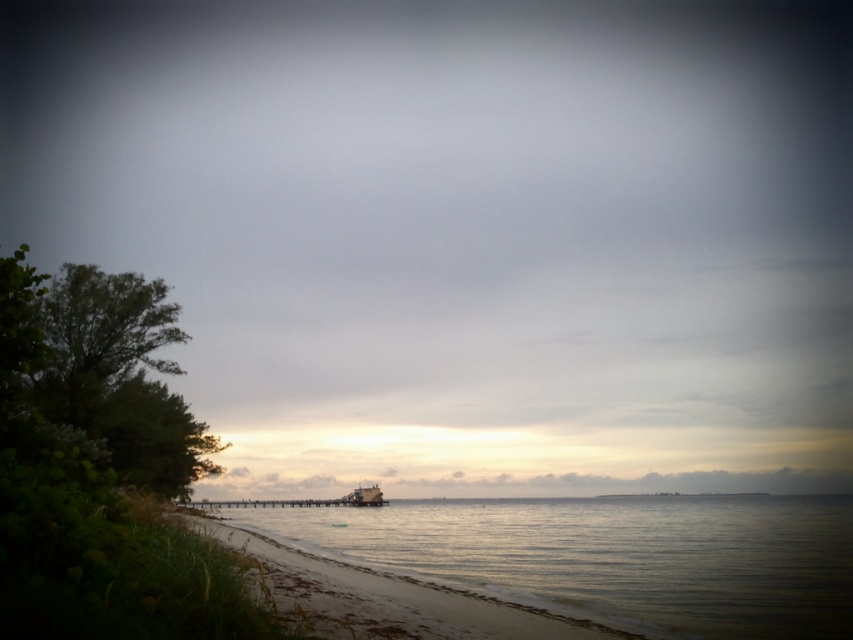
You are standing on the shore and see the clear water at lower left and the metallic gray boat at center. Which object is closer to you?

The clear water at lower left is closer to you because it is above the metallic gray boat at center, indicating it is positioned nearer in the scene.

You are a photographer planning to capture the metallic gray boat at center and the clear water at lower left in a single frame. Which object will occupy a larger portion of the photo?

The clear water at lower left is larger in size than the metallic gray boat at center, so it will occupy a larger portion of the photo.

You are standing on the beach and see the clear water at lower left and the metallic gray boat at center. Which object is nearer to you?

The clear water at lower left is closer to the viewer than the metallic gray boat at center.